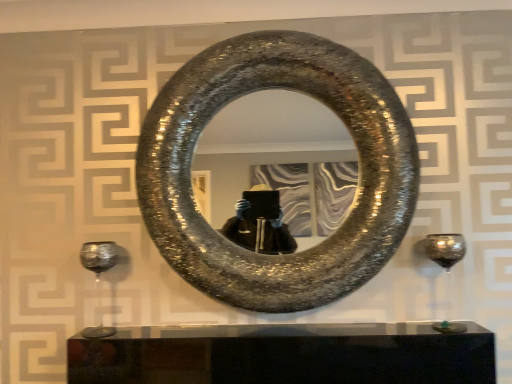
In order to face shiny metallic horseshoe at center, should I rotate leftwards or rightwards?

Rotate right and turn 2.495 degrees.

This screenshot has width=512, height=384. What do you see at coordinates (359, 171) in the screenshot? I see `shiny metallic horseshoe at center` at bounding box center [359, 171].

Identify the location of transparent glass wine glass at right, the second wine glass positioned from the left. (446, 271).

How much space does transparent glass wine glass at right, acting as the first wine glass starting from the right, occupy vertically?

It is 11.84 inches.

You are a GUI agent. You are given a task and a screenshot of the screen. Output one action in this format:
    pyautogui.click(x=<x>, y=<y>)
    Task: Click on the shiny metallic horseshoe at center
    
    Given the screenshot: What is the action you would take?
    pyautogui.click(x=359, y=171)

Is shiny metallic wine glass at lower left, which is the second wine glass from right to left, looking in the opposite direction of shiny metallic horseshoe at center?

No.

From the picture: Measure the distance from shiny metallic wine glass at lower left, which is the second wine glass from right to left, to shiny metallic horseshoe at center.

shiny metallic wine glass at lower left, which is the second wine glass from right to left, is 24.17 inches from shiny metallic horseshoe at center.

From the image's perspective, is shiny metallic wine glass at lower left, the 1th wine glass from the left, above or below shiny metallic horseshoe at center?

Clearly, from the image's perspective, shiny metallic wine glass at lower left, the 1th wine glass from the left, is below shiny metallic horseshoe at center.

Which object is positioned more to the right, shiny metallic wine glass at lower left, the 1th wine glass from the left, or transparent glass wine glass at right, acting as the first wine glass starting from the right?

transparent glass wine glass at right, acting as the first wine glass starting from the right, is more to the right.

Is shiny metallic wine glass at lower left, the 1th wine glass from the left, thinner than transparent glass wine glass at right, acting as the first wine glass starting from the right?

In fact, shiny metallic wine glass at lower left, the 1th wine glass from the left, might be wider than transparent glass wine glass at right, acting as the first wine glass starting from the right.

Is point (97, 284) closer or farther from the camera than point (453, 244)?

Clearly, point (97, 284) is more distant from the camera than point (453, 244).

Looking at this image, how different are the orientations of shiny metallic wine glass at lower left, the 1th wine glass from the left, and transparent glass wine glass at right, acting as the first wine glass starting from the right, in degrees?

They differ by 0.381 degrees in their facing directions.

Is the depth of transparent glass wine glass at right, the second wine glass positioned from the left, less than that of shiny metallic horseshoe at center?

No.

Can you confirm if transparent glass wine glass at right, acting as the first wine glass starting from the right, is positioned to the left of shiny metallic horseshoe at center?

Incorrect, transparent glass wine glass at right, acting as the first wine glass starting from the right, is not on the left side of shiny metallic horseshoe at center.

In terms of size, does transparent glass wine glass at right, the second wine glass positioned from the left, appear bigger or smaller than shiny metallic horseshoe at center?

transparent glass wine glass at right, the second wine glass positioned from the left, is smaller than shiny metallic horseshoe at center.

Is shiny metallic horseshoe at center aimed at shiny metallic wine glass at lower left, which is the second wine glass from right to left?

No, shiny metallic horseshoe at center is not oriented towards shiny metallic wine glass at lower left, which is the second wine glass from right to left.

Based on the photo, between shiny metallic horseshoe at center and shiny metallic wine glass at lower left, the 1th wine glass from the left, which one has more height?

Standing taller between the two is shiny metallic horseshoe at center.

Considering the sizes of objects shiny metallic horseshoe at center and shiny metallic wine glass at lower left, which is the second wine glass from right to left, in the image provided, who is smaller, shiny metallic horseshoe at center or shiny metallic wine glass at lower left, which is the second wine glass from right to left,?

shiny metallic wine glass at lower left, which is the second wine glass from right to left.

Is shiny metallic horseshoe at center directly adjacent to shiny metallic wine glass at lower left, which is the second wine glass from right to left?

No.

Is the surface of shiny metallic horseshoe at center in direct contact with transparent glass wine glass at right, the second wine glass positioned from the left?

No, shiny metallic horseshoe at center is not making contact with transparent glass wine glass at right, the second wine glass positioned from the left.

Which object is wider, shiny metallic horseshoe at center or transparent glass wine glass at right, acting as the first wine glass starting from the right?

With larger width is shiny metallic horseshoe at center.

In the scene shown: Is shiny metallic horseshoe at center located outside transparent glass wine glass at right, the second wine glass positioned from the left?

shiny metallic horseshoe at center is positioned outside transparent glass wine glass at right, the second wine glass positioned from the left.

What's the angular difference between shiny metallic horseshoe at center and transparent glass wine glass at right, acting as the first wine glass starting from the right,'s facing directions?

0.576 degrees.

Is transparent glass wine glass at right, the second wine glass positioned from the left, turned away from shiny metallic wine glass at lower left, the 1th wine glass from the left?

No, transparent glass wine glass at right, the second wine glass positioned from the left, is not facing the opposite direction of shiny metallic wine glass at lower left, the 1th wine glass from the left.

Based on the photo, measure the distance between transparent glass wine glass at right, acting as the first wine glass starting from the right, and shiny metallic wine glass at lower left, the 1th wine glass from the left.

transparent glass wine glass at right, acting as the first wine glass starting from the right, is 3.65 feet away from shiny metallic wine glass at lower left, the 1th wine glass from the left.

Can you tell me how much transparent glass wine glass at right, acting as the first wine glass starting from the right, and shiny metallic wine glass at lower left, the 1th wine glass from the left, differ in facing direction?

They differ by 0.381 degrees in their facing directions.

Which is more to the left, transparent glass wine glass at right, the second wine glass positioned from the left, or shiny metallic wine glass at lower left, the 1th wine glass from the left?

shiny metallic wine glass at lower left, the 1th wine glass from the left.

At what (x,y) coordinates should I click in order to perform the action: click on horseshoe above the shiny metallic wine glass at lower left, the 1th wine glass from the left (from the image's perspective). Please return your answer as a coordinate pair (x, y). The image size is (512, 384). Looking at the image, I should click on (359, 171).

I want to click on wine glass located underneath the shiny metallic wine glass at lower left, the 1th wine glass from the left (from a real-world perspective), so click(x=446, y=271).

Which object lies nearer to the anchor point transparent glass wine glass at right, the second wine glass positioned from the left, shiny metallic wine glass at lower left, which is the second wine glass from right to left, or shiny metallic horseshoe at center?

Among the two, shiny metallic horseshoe at center is located nearer to transparent glass wine glass at right, the second wine glass positioned from the left.

Based on their spatial positions, is shiny metallic wine glass at lower left, which is the second wine glass from right to left, or transparent glass wine glass at right, the second wine glass positioned from the left, further from shiny metallic horseshoe at center?

shiny metallic wine glass at lower left, which is the second wine glass from right to left, lies further to shiny metallic horseshoe at center than the other object.

Which object lies further to the anchor point shiny metallic wine glass at lower left, the 1th wine glass from the left, shiny metallic horseshoe at center or transparent glass wine glass at right, the second wine glass positioned from the left?

transparent glass wine glass at right, the second wine glass positioned from the left, is positioned further to the anchor shiny metallic wine glass at lower left, the 1th wine glass from the left.

Which object lies further to the anchor point shiny metallic wine glass at lower left, the 1th wine glass from the left, transparent glass wine glass at right, the second wine glass positioned from the left, or shiny metallic horseshoe at center?

transparent glass wine glass at right, the second wine glass positioned from the left, is further to shiny metallic wine glass at lower left, the 1th wine glass from the left.

Estimate the real-world distances between objects in this image. Which object is further from shiny metallic horseshoe at center, transparent glass wine glass at right, the second wine glass positioned from the left, or shiny metallic wine glass at lower left, which is the second wine glass from right to left?

shiny metallic wine glass at lower left, which is the second wine glass from right to left.

Estimate the real-world distances between objects in this image. Which object is closer to transparent glass wine glass at right, acting as the first wine glass starting from the right, shiny metallic horseshoe at center or shiny metallic wine glass at lower left, the 1th wine glass from the left?

Among the two, shiny metallic horseshoe at center is located nearer to transparent glass wine glass at right, acting as the first wine glass starting from the right.

The height and width of the screenshot is (384, 512). In order to click on horseshoe situated between shiny metallic wine glass at lower left, the 1th wine glass from the left, and transparent glass wine glass at right, the second wine glass positioned from the left, from left to right in this screenshot , I will do `click(359, 171)`.